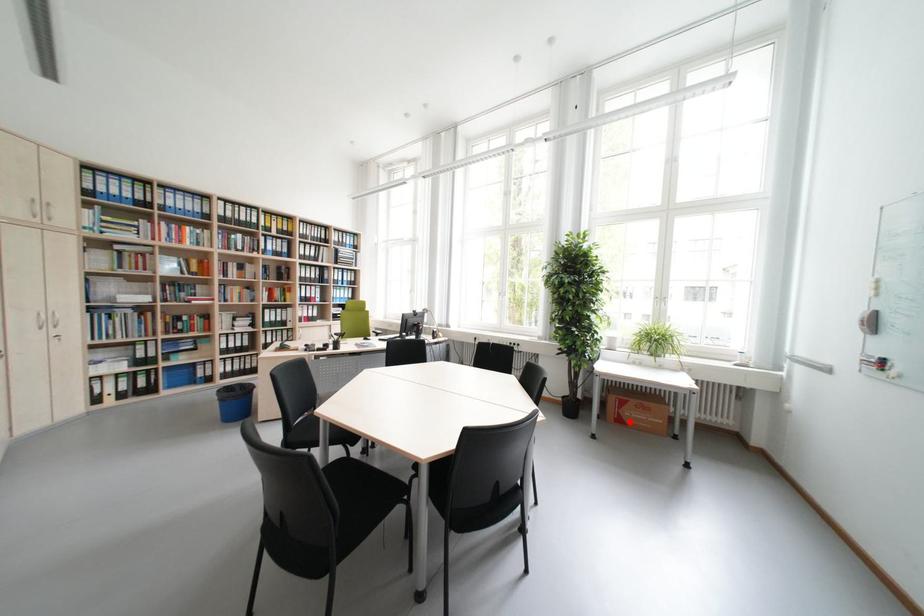
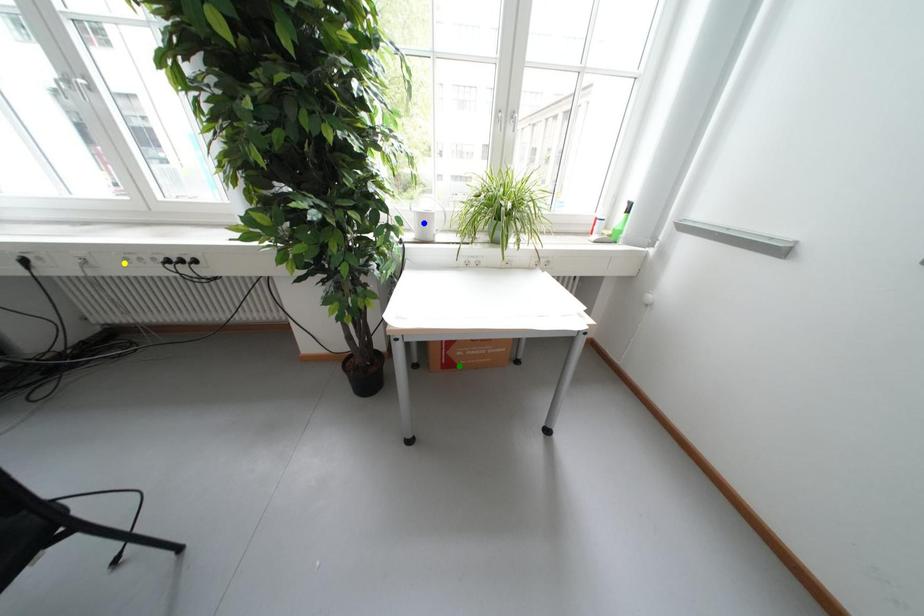
Question: I am providing you with two images of the same scene from different viewpoints. A red point is marked on the first image. You are given multiple points on the second image. In image 2, which mark is for the same physical point as the one in image 1?

Choices:
 (A) yellow point
 (B) green point
 (C) blue point

Answer: (B)